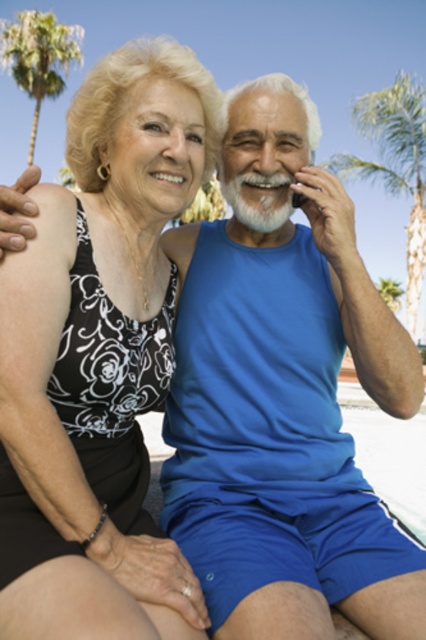
Is black floral tank top at upper left closer to camera compared to green leafy palm tree at upper left?

Yes, black floral tank top at upper left is closer to the viewer.

Between point (63, 442) and point (42, 49), which one is positioned behind?

Point (42, 49)

You are a GUI agent. You are given a task and a screenshot of the screen. Output one action in this format:
    pyautogui.click(x=<x>, y=<y>)
    Task: Click on the black floral tank top at upper left
    The width and height of the screenshot is (426, 640).
    Given the screenshot: What is the action you would take?
    pyautogui.click(x=100, y=358)

Measure the distance between point (394,182) and camera.

The distance of point (394,182) from camera is 23.58 meters.

Who is more distant from viewer, (405, 156) or (51, 20)?

The point (51, 20) is behind.

Image resolution: width=426 pixels, height=640 pixels. Identify the location of green leafy palm tree at upper right. (396, 164).

The height and width of the screenshot is (640, 426). What are the coordinates of `green leafy palm tree at upper right` in the screenshot? It's located at (396, 164).

Can you confirm if blue fabric tank top at center is smaller than green leafy palm tree at upper left?

Yes, blue fabric tank top at center is smaller than green leafy palm tree at upper left.

Can you confirm if blue fabric tank top at center is taller than green leafy palm tree at upper left?

In fact, blue fabric tank top at center may be shorter than green leafy palm tree at upper left.

Does point (169, 413) lie behind point (34, 93)?

No, (169, 413) is in front of (34, 93).

This screenshot has width=426, height=640. I want to click on blue fabric tank top at center, so click(284, 394).